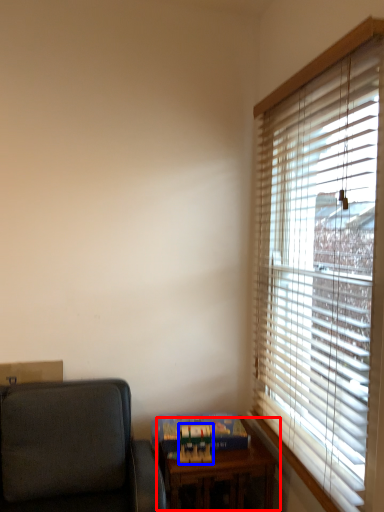
Question: Which of the following is the farthest to the observer, table (highlighted by a red box) or paperback book (highlighted by a blue box)?

Choices:
 (A) table
 (B) paperback book

Answer: (B)